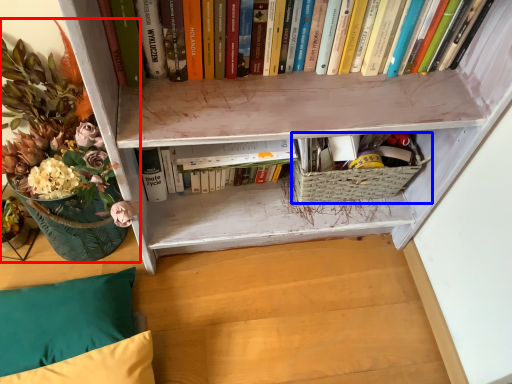
Question: Which of the following is the closest to the observer, floral arrangement (highlighted by a red box) or basket (highlighted by a blue box)?

Choices:
 (A) floral arrangement
 (B) basket

Answer: (A)